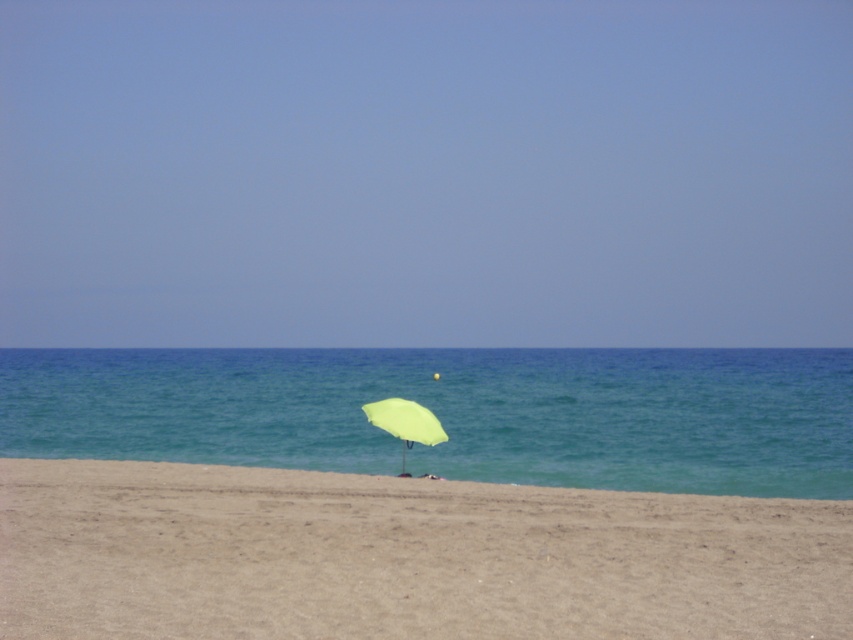
Question: Which object is farther from the camera taking this photo?

Choices:
 (A) beige sandy beach at center
 (B) transparent blue water at center

Answer: (B)

Question: Where is beige sandy beach at center located in relation to transparent blue water at center in the image?

Choices:
 (A) above
 (B) below

Answer: (B)

Question: Is the position of transparent blue water at center less distant than that of light green fabric umbrella at center?

Choices:
 (A) no
 (B) yes

Answer: (A)

Question: Which of the following is the closest to the observer?

Choices:
 (A) 399,435
 (B) 785,435
 (C) 392,522

Answer: (C)

Question: Which object is farther from the camera taking this photo?

Choices:
 (A) beige sandy beach at center
 (B) light green fabric umbrella at center

Answer: (B)

Question: Is beige sandy beach at center below transparent blue water at center?

Choices:
 (A) no
 (B) yes

Answer: (B)